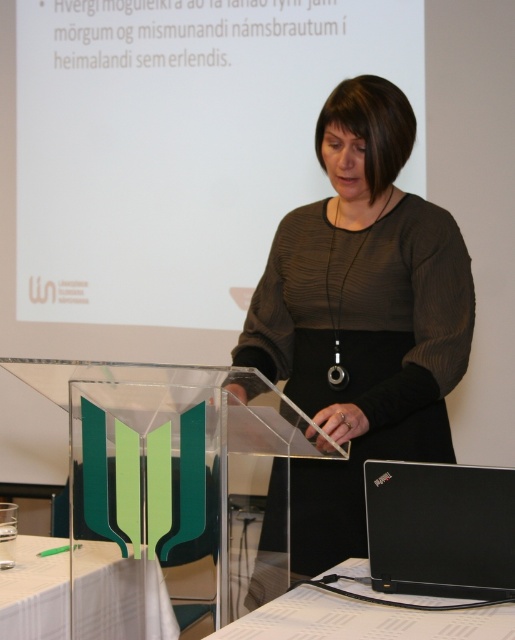
Question: Can you confirm if matte black dress at center is positioned below white glossy table at lower left?

Choices:
 (A) yes
 (B) no

Answer: (B)

Question: Which object appears closest to the camera in this image?

Choices:
 (A) matte black dress at center
 (B) black plastic table at lower center
 (C) white glossy table at lower left
 (D) black matte laptop at lower right

Answer: (B)

Question: Which object appears farthest from the camera in this image?

Choices:
 (A) black matte laptop at lower right
 (B) black plastic table at lower center
 (C) white glossy table at lower left

Answer: (C)

Question: Which is farther from the black plastic table at lower center?

Choices:
 (A) white glossy table at lower left
 (B) black matte laptop at lower right
 (C) matte black dress at center

Answer: (C)

Question: Can you confirm if matte black dress at center is thinner than black matte laptop at lower right?

Choices:
 (A) yes
 (B) no

Answer: (B)

Question: Does white glossy table at lower left have a larger size compared to black plastic table at lower center?

Choices:
 (A) no
 (B) yes

Answer: (B)